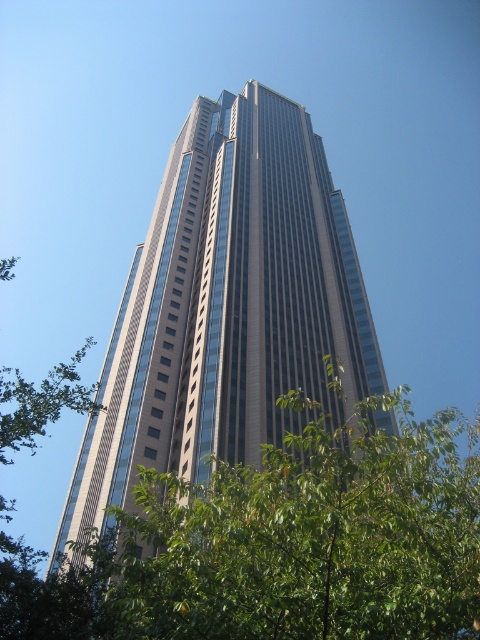
Can you confirm if glassy steel skyscraper at center is bigger than green leafy tree at center?

Correct, glassy steel skyscraper at center is larger in size than green leafy tree at center.

Which is in front, point (288, 276) or point (427, 451)?

Point (427, 451) is in front.

The width and height of the screenshot is (480, 640). What are the coordinates of `glassy steel skyscraper at center` in the screenshot? It's located at (227, 308).